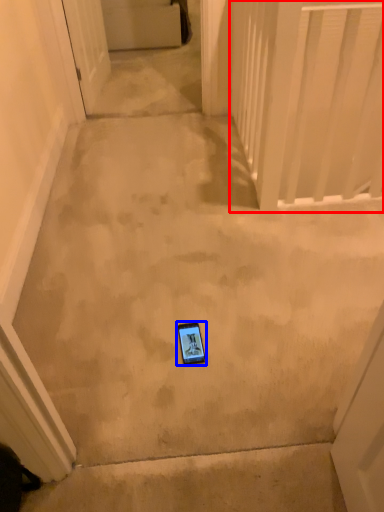
Question: Which object appears closest to the camera in this image, balustrade (highlighted by a red box) or mobile phone (highlighted by a blue box)?

Choices:
 (A) balustrade
 (B) mobile phone

Answer: (B)